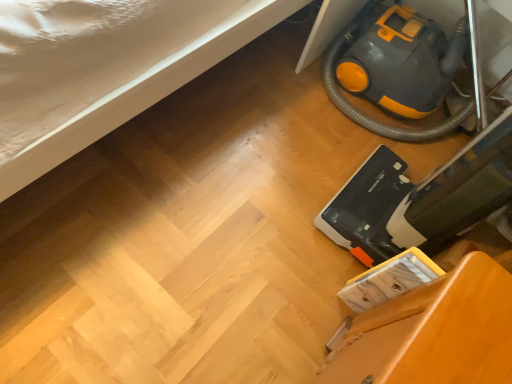
Question: Is yellow-orange plastic vacuum cleaner at lower right, which is counted as the second equipment, starting from the front, further to camera compared to yellow-orange plastic vacuum cleaner at lower right, the second equipment when ordered from back to front?

Choices:
 (A) no
 (B) yes

Answer: (B)

Question: From a real-world perspective, does yellow-orange plastic vacuum cleaner at lower right, placed as the 1th equipment when sorted from back to front, sit lower than yellow-orange plastic vacuum cleaner at lower right, the second equipment when ordered from back to front?

Choices:
 (A) yes
 (B) no

Answer: (A)

Question: Does yellow-orange plastic vacuum cleaner at lower right, placed as the 1th equipment when sorted from back to front, appear on the left side of yellow-orange plastic vacuum cleaner at lower right, the second equipment when ordered from back to front?

Choices:
 (A) no
 (B) yes

Answer: (A)

Question: Could you tell me if yellow-orange plastic vacuum cleaner at lower right, which is counted as the second equipment, starting from the front, is facing yellow-orange plastic vacuum cleaner at lower right, the first equipment viewed from the front?

Choices:
 (A) no
 (B) yes

Answer: (B)

Question: From the image's perspective, would you say yellow-orange plastic vacuum cleaner at lower right, which is counted as the second equipment, starting from the front, is shown under yellow-orange plastic vacuum cleaner at lower right, the second equipment when ordered from back to front?

Choices:
 (A) no
 (B) yes

Answer: (A)

Question: Relative to wooden chair at lower right, is yellow-orange plastic vacuum cleaner at lower right, the first equipment viewed from the front, in front or behind?

Choices:
 (A) behind
 (B) front

Answer: (A)

Question: From a real-world perspective, relative to wooden chair at lower right, is yellow-orange plastic vacuum cleaner at lower right, the second equipment when ordered from back to front, vertically above or below?

Choices:
 (A) above
 (B) below

Answer: (A)

Question: Considering the positions of yellow-orange plastic vacuum cleaner at lower right, the second equipment when ordered from back to front, and wooden chair at lower right in the image, is yellow-orange plastic vacuum cleaner at lower right, the second equipment when ordered from back to front, wider or thinner than wooden chair at lower right?

Choices:
 (A) thin
 (B) wide

Answer: (B)

Question: Does point (490, 185) appear closer or farther from the camera than point (351, 379)?

Choices:
 (A) closer
 (B) farther

Answer: (B)

Question: In the image, is yellow-orange plastic vacuum cleaner at lower right, placed as the 1th equipment when sorted from back to front, on the left side or the right side of yellow-orange plastic vacuum cleaner at lower right, the first equipment viewed from the front?

Choices:
 (A) left
 (B) right

Answer: (B)

Question: Is yellow-orange plastic vacuum cleaner at lower right, which is counted as the second equipment, starting from the front, spatially inside yellow-orange plastic vacuum cleaner at lower right, the second equipment when ordered from back to front, or outside of it?

Choices:
 (A) outside
 (B) inside

Answer: (A)

Question: Looking at the image, does yellow-orange plastic vacuum cleaner at lower right, which is counted as the second equipment, starting from the front, seem bigger or smaller compared to yellow-orange plastic vacuum cleaner at lower right, the second equipment when ordered from back to front?

Choices:
 (A) small
 (B) big

Answer: (B)

Question: Is point (356, 24) closer or farther from the camera than point (366, 185)?

Choices:
 (A) closer
 (B) farther

Answer: (B)

Question: Considering the positions of point (455, 226) and point (349, 114), is point (455, 226) closer or farther from the camera than point (349, 114)?

Choices:
 (A) closer
 (B) farther

Answer: (A)

Question: In the image, is yellow-orange plastic vacuum cleaner at lower right, the first equipment viewed from the front, positioned in front of or behind yellow-orange plastic vacuum cleaner at lower right, which is counted as the second equipment, starting from the front?

Choices:
 (A) behind
 (B) front

Answer: (B)